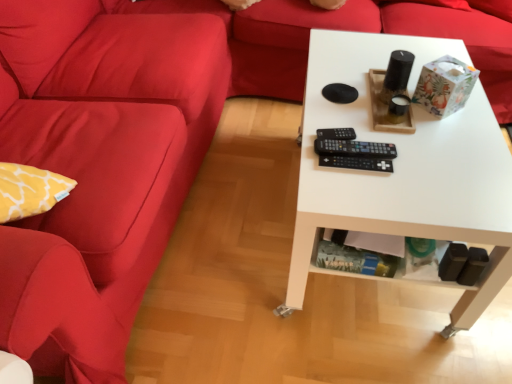
Question: Based on their sizes in the image, would you say matte red couch at left is bigger or smaller than black plastic remote at center, the 3th control in the bottom-to-top sequence?

Choices:
 (A) big
 (B) small

Answer: (A)

Question: From a real-world perspective, is matte red couch at left above or below black plastic remote at center, acting as the 1th control starting from the top?

Choices:
 (A) below
 (B) above

Answer: (A)

Question: Based on their relative distances, which object is nearer to the black plastic remote at center, positioned as the second control in bottom-to-top order?

Choices:
 (A) velvet red couch at left
 (B) white matte table at center
 (C) matte red couch at left
 (D) black plastic remote at center, acting as the 1th control starting from the top
 (E) black plastic remote at center, the 1th control when ordered from bottom to top

Answer: (E)

Question: Estimate the real-world distances between objects in this image. Which object is farther from the black plastic remote at center, the 1th control when ordered from bottom to top?

Choices:
 (A) white matte table at center
 (B) matte red couch at left
 (C) black plastic remote at center, acting as the 1th control starting from the top
 (D) velvet red couch at left
 (E) black plastic remote at center, positioned as the second control in bottom-to-top order

Answer: (D)